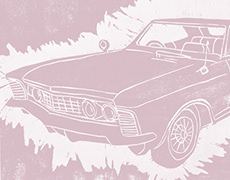
Identify the location of mirror. (105, 46).